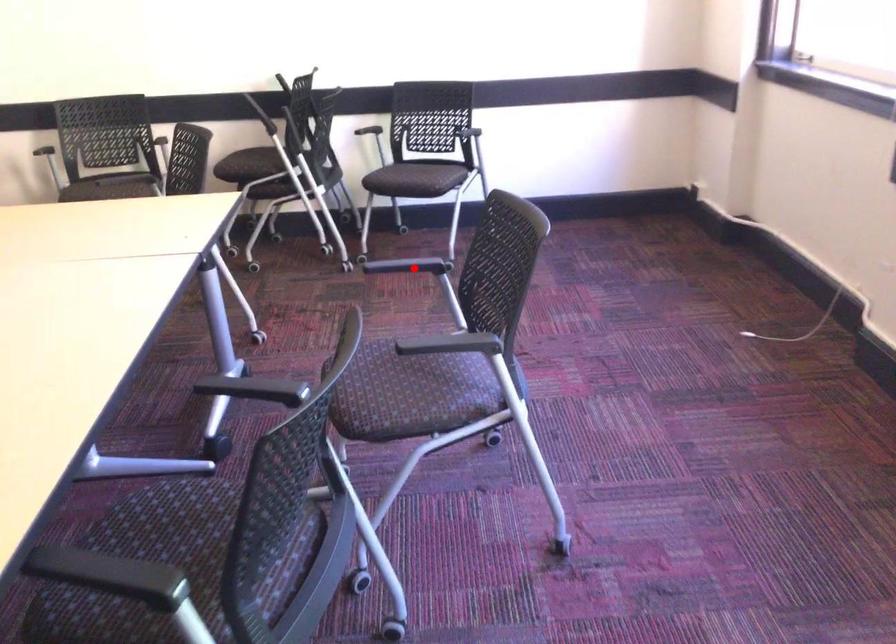
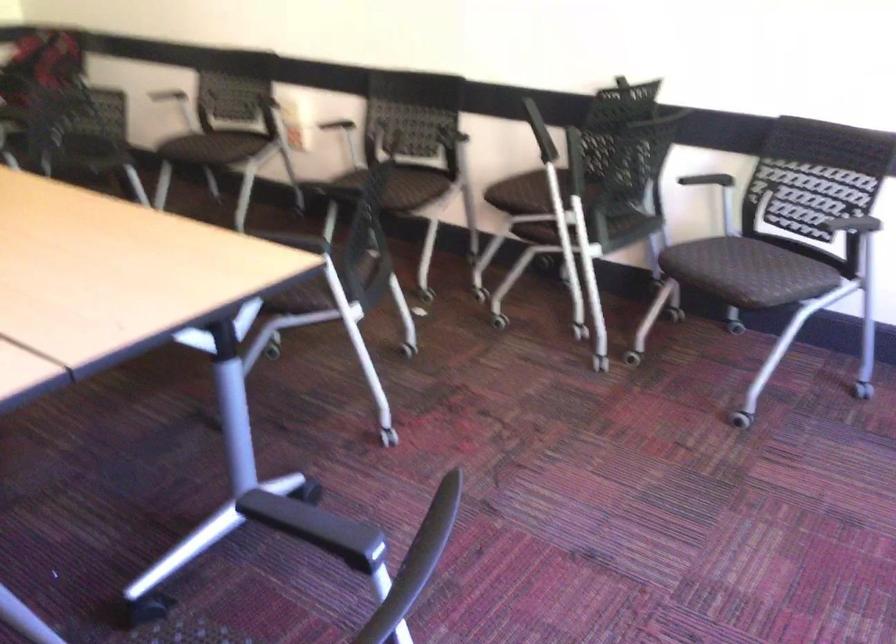
Question: I am providing you with two images of the same scene from different viewpoints. A red point is marked on the first image. At the location where the point appears in image 1, is it still visible in image 2?

Choices:
 (A) Yes
 (B) No

Answer: (B)